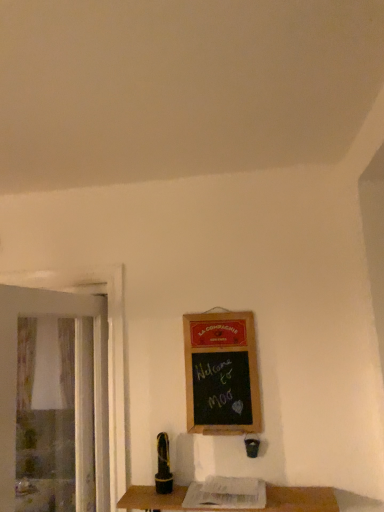
The width and height of the screenshot is (384, 512). I want to click on wooden table at lower center, so click(x=233, y=508).

Measure the distance between point (96, 423) and camera.

The distance of point (96, 423) from camera is 6.11 feet.

I want to click on wooden table at lower center, so click(233, 508).

Considering the sizes of objects wooden table at lower center and wooden framed chalkboard at center-right in the image provided, who is shorter, wooden table at lower center or wooden framed chalkboard at center-right?

wooden table at lower center is shorter.

Is wooden table at lower center to the left of wooden framed chalkboard at center-right from the viewer's perspective?

No.

From a real-world perspective, between wooden table at lower center and wooden framed chalkboard at center-right, who is vertically lower?

wooden table at lower center is physically lower.

Considering the relative sizes of transparent plastic screen door at left and wooden table at lower center in the image provided, is transparent plastic screen door at left thinner than wooden table at lower center?

Yes, transparent plastic screen door at left is thinner than wooden table at lower center.

Looking at the image, does transparent plastic screen door at left seem bigger or smaller compared to wooden table at lower center?

Considering their sizes, transparent plastic screen door at left takes up more space than wooden table at lower center.

Is transparent plastic screen door at left directly adjacent to wooden table at lower center?

No, transparent plastic screen door at left is not making contact with wooden table at lower center.

Could you tell me if transparent plastic screen door at left is facing wooden table at lower center?

No, transparent plastic screen door at left is not facing towards wooden table at lower center.

Which object is wider, wooden framed chalkboard at center-right or wooden table at lower center?

wooden table at lower center is wider.

In the image, is wooden framed chalkboard at center-right on the left side or the right side of wooden table at lower center?

In the image, wooden framed chalkboard at center-right appears on the left side of wooden table at lower center.

From the image's perspective, which one is positioned higher, wooden framed chalkboard at center-right or wooden table at lower center?

wooden framed chalkboard at center-right.

Which of these two, wooden framed chalkboard at center-right or wooden table at lower center, is smaller?

Smaller between the two is wooden framed chalkboard at center-right.

Which is closer, (185, 340) or (49, 297)?

Point (185, 340) is positioned farther from the camera compared to point (49, 297).

Which object is further away from the camera, wooden framed chalkboard at center-right or transparent plastic screen door at left?

wooden framed chalkboard at center-right is more distant.

Is transparent plastic screen door at left wider than wooden framed chalkboard at center-right?

Correct, the width of transparent plastic screen door at left exceeds that of wooden framed chalkboard at center-right.

Is transparent plastic screen door at left far away from wooden framed chalkboard at center-right?

No, transparent plastic screen door at left is not far away from wooden framed chalkboard at center-right.

Do you think transparent plastic screen door at left is within wooden framed chalkboard at center-right, or outside of it?

transparent plastic screen door at left is spatially situated outside wooden framed chalkboard at center-right.

From a real-world perspective, which object rests below the other?

wooden table at lower center is physically lower.

Where is `screen door above the wooden table at lower center (from a real-world perspective)`? This screenshot has height=512, width=384. screen door above the wooden table at lower center (from a real-world perspective) is located at coordinates (15, 375).

Measure the distance between wooden table at lower center and transparent plastic screen door at left.

wooden table at lower center and transparent plastic screen door at left are 23.26 inches apart.

Considering the sizes of wooden table at lower center and transparent plastic screen door at left in the image, is wooden table at lower center bigger or smaller than transparent plastic screen door at left?

Considering their sizes, wooden table at lower center takes up less space than transparent plastic screen door at left.

Find the location of a particular element. bulletin board that appears above the wooden table at lower center (from the image's perspective) is located at coordinates (221, 374).

There is a wooden table at lower center. Identify the location of screen door above it (from a real-world perspective). (15, 375).

When comparing their distances from wooden table at lower center, does transparent plastic screen door at left or wooden framed chalkboard at center-right seem closer?

wooden framed chalkboard at center-right is closer to wooden table at lower center.

From the picture: Based on their spatial positions, is wooden framed chalkboard at center-right or wooden table at lower center further from transparent plastic screen door at left?

wooden table at lower center is further to transparent plastic screen door at left.

From the image, which object appears to be nearer to wooden framed chalkboard at center-right, transparent plastic screen door at left or wooden table at lower center?

wooden table at lower center is positioned closer to the anchor wooden framed chalkboard at center-right.

Considering their positions, is wooden table at lower center positioned closer to wooden framed chalkboard at center-right than transparent plastic screen door at left?

wooden table at lower center is closer to wooden framed chalkboard at center-right.

Considering their positions, is wooden framed chalkboard at center-right positioned closer to wooden table at lower center than transparent plastic screen door at left?

The object closer to wooden table at lower center is wooden framed chalkboard at center-right.

Consider the image. Considering their positions, is wooden table at lower center positioned further to transparent plastic screen door at left than wooden framed chalkboard at center-right?

The object further to transparent plastic screen door at left is wooden table at lower center.

This screenshot has height=512, width=384. Find the location of `bulletin board between transparent plastic screen door at left and wooden table at lower center in the horizontal direction`. bulletin board between transparent plastic screen door at left and wooden table at lower center in the horizontal direction is located at coordinates (221, 374).